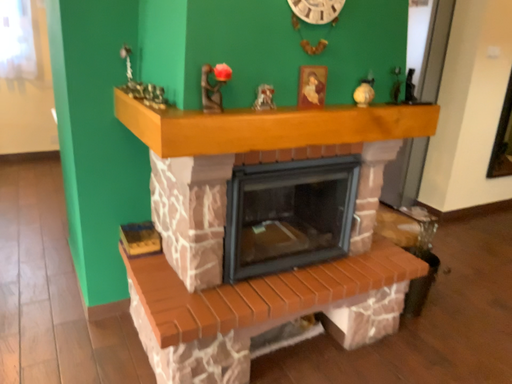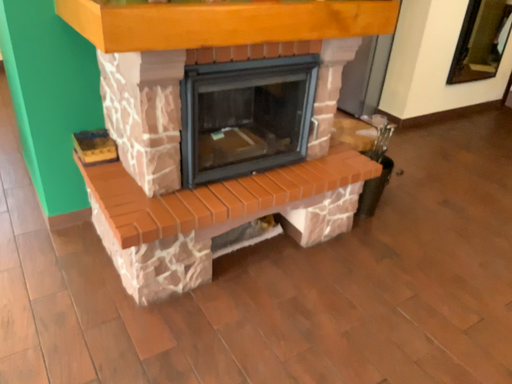
Question: How did the camera likely rotate when shooting the video?

Choices:
 (A) rotated downward
 (B) rotated upward

Answer: (A)